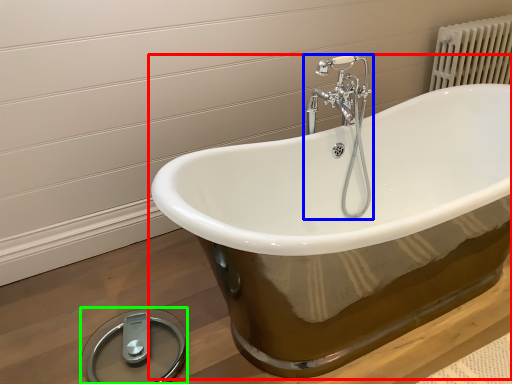
Question: Which is nearer to the bathtub (highlighted by a red box)? tap (highlighted by a blue box) or scale (highlighted by a green box).

Choices:
 (A) tap
 (B) scale

Answer: (A)